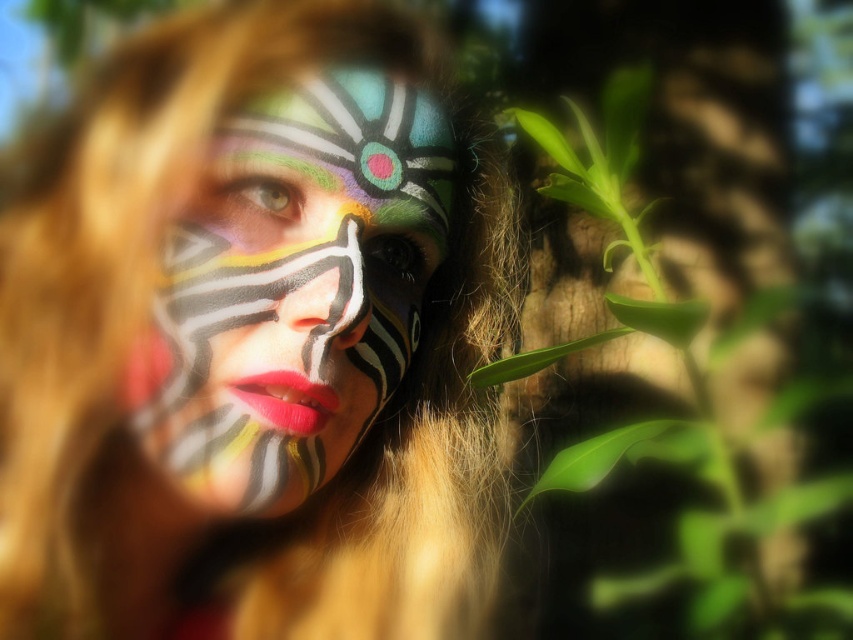
Question: Which point is closer to the camera?

Choices:
 (A) matte paint face at center
 (B) matte painted face at center

Answer: (A)

Question: Is matte paint face at center closer to camera compared to matte painted face at center?

Choices:
 (A) yes
 (B) no

Answer: (A)

Question: Which of the following is the farthest from the observer?

Choices:
 (A) (149, 241)
 (B) (279, 436)

Answer: (B)

Question: Does matte paint face at center appear under matte painted face at center?

Choices:
 (A) yes
 (B) no

Answer: (A)

Question: Considering the relative positions of matte paint face at center and matte painted face at center in the image provided, where is matte paint face at center located with respect to matte painted face at center?

Choices:
 (A) right
 (B) left

Answer: (A)